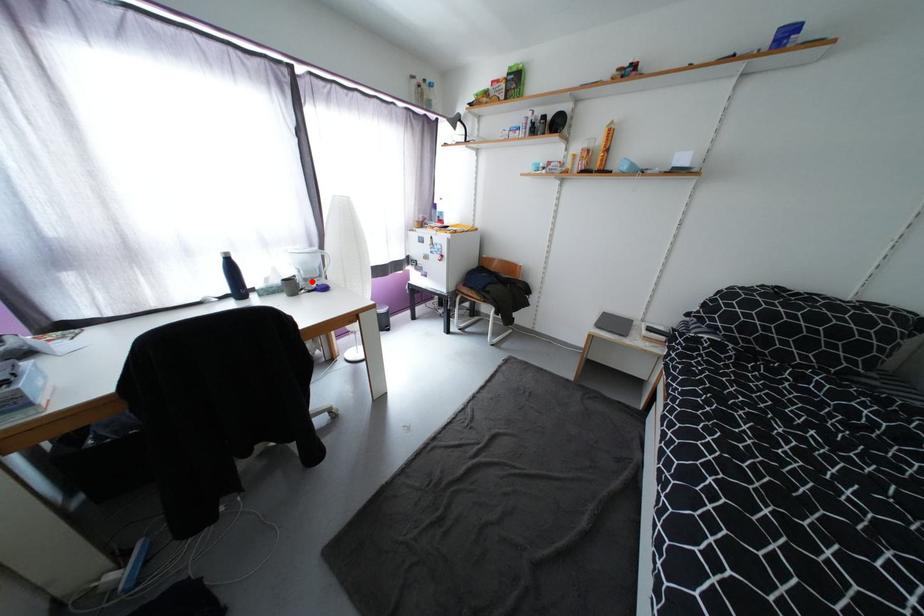
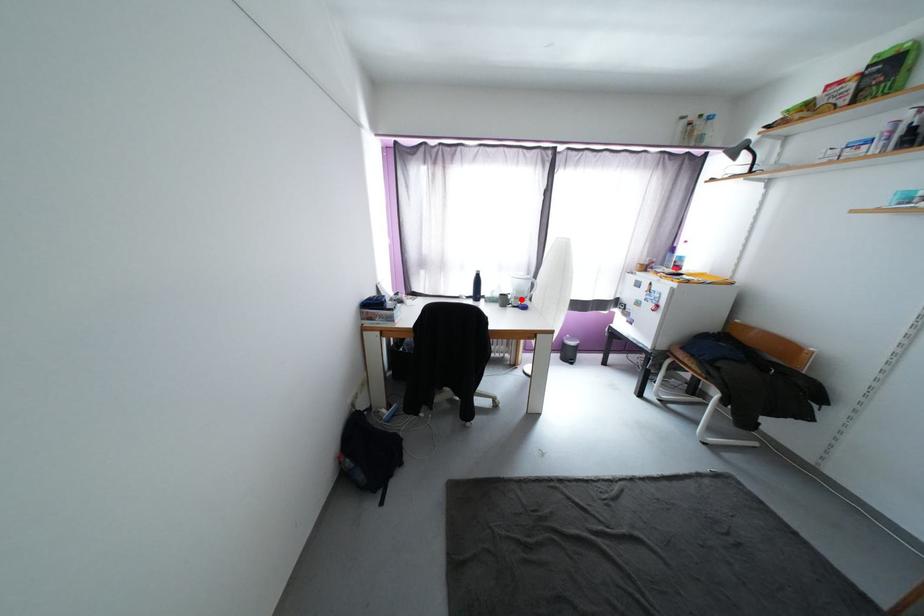
I am providing you with two images of the same scene from different viewpoints. A red point is marked on the first image and another point is marked on the second image. Do the highlighted points in image1 and image2 indicate the same real-world spot?

Yes